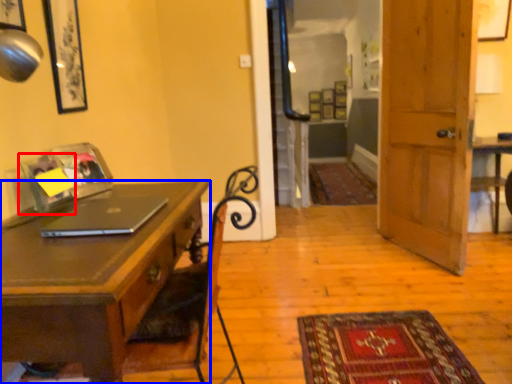
Question: Which object appears farthest to the camera in this image, picture frame (highlighted by a red box) or desk (highlighted by a blue box)?

Choices:
 (A) picture frame
 (B) desk

Answer: (A)